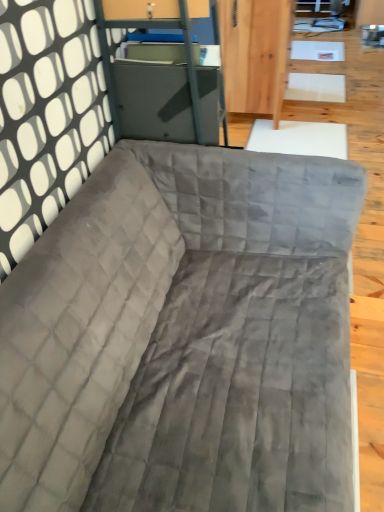
The height and width of the screenshot is (512, 384). In order to click on velvet gray couch at center in this screenshot , I will do `click(180, 339)`.

The image size is (384, 512). What do you see at coordinates (180, 339) in the screenshot?
I see `velvet gray couch at center` at bounding box center [180, 339].

What do you see at coordinates (146, 27) in the screenshot? This screenshot has width=384, height=512. I see `matte gray metal file cabinet at upper center` at bounding box center [146, 27].

Image resolution: width=384 pixels, height=512 pixels. I want to click on matte gray metal file cabinet at upper center, so click(146, 27).

This screenshot has width=384, height=512. Identify the location of velvet gray couch at center. (180, 339).

Between velvet gray couch at center and matte gray metal file cabinet at upper center, which one appears on the left side from the viewer's perspective?

matte gray metal file cabinet at upper center.

Is velvet gray couch at center behind matte gray metal file cabinet at upper center?

That is False.

Is point (37, 408) in front of point (179, 14)?

Yes.

Looking at this image, from the image's perspective, does velvet gray couch at center appear lower than matte gray metal file cabinet at upper center?

Indeed, from the image's perspective, velvet gray couch at center is shown beneath matte gray metal file cabinet at upper center.

From a real-world perspective, is velvet gray couch at center beneath matte gray metal file cabinet at upper center?

Indeed, from a real-world perspective, velvet gray couch at center is positioned beneath matte gray metal file cabinet at upper center.

Which object is wider, velvet gray couch at center or matte gray metal file cabinet at upper center?

With larger width is velvet gray couch at center.

Is velvet gray couch at center taller than matte gray metal file cabinet at upper center?

Correct, velvet gray couch at center is much taller as matte gray metal file cabinet at upper center.

Does velvet gray couch at center have a larger size compared to matte gray metal file cabinet at upper center?

Correct, velvet gray couch at center is larger in size than matte gray metal file cabinet at upper center.

Is velvet gray couch at center inside the boundaries of matte gray metal file cabinet at upper center, or outside?

velvet gray couch at center is outside matte gray metal file cabinet at upper center.

Is the surface of velvet gray couch at center in direct contact with matte gray metal file cabinet at upper center?

No, velvet gray couch at center is not next to matte gray metal file cabinet at upper center.

Is velvet gray couch at center facing towards matte gray metal file cabinet at upper center?

No, velvet gray couch at center is not turned towards matte gray metal file cabinet at upper center.

How far apart are velvet gray couch at center and matte gray metal file cabinet at upper center?

velvet gray couch at center and matte gray metal file cabinet at upper center are 19.77 inches apart from each other.

This screenshot has height=512, width=384. In order to click on studio couch on the right of matte gray metal file cabinet at upper center in this screenshot , I will do `click(180, 339)`.

Is matte gray metal file cabinet at upper center to the left or to the right of velvet gray couch at center in the image?

Based on their positions, matte gray metal file cabinet at upper center is located to the left of velvet gray couch at center.

Between matte gray metal file cabinet at upper center and velvet gray couch at center, which one is positioned behind?

Positioned behind is matte gray metal file cabinet at upper center.

Considering the positions of point (189, 61) and point (268, 316), is point (189, 61) closer or farther from the camera than point (268, 316)?

Clearly, point (189, 61) is closer to the camera than point (268, 316).

From the image's perspective, is matte gray metal file cabinet at upper center on velvet gray couch at center?

Correct, matte gray metal file cabinet at upper center appears higher than velvet gray couch at center in the image.

From a real-world perspective, is matte gray metal file cabinet at upper center on top of velvet gray couch at center?

Yes.

Is matte gray metal file cabinet at upper center wider than velvet gray couch at center?

Incorrect, the width of matte gray metal file cabinet at upper center does not surpass that of velvet gray couch at center.

Can you confirm if matte gray metal file cabinet at upper center is shorter than velvet gray couch at center?

Yes.

Looking at the image, does matte gray metal file cabinet at upper center seem bigger or smaller compared to velvet gray couch at center?

Clearly, matte gray metal file cabinet at upper center is smaller in size than velvet gray couch at center.

Is matte gray metal file cabinet at upper center not within velvet gray couch at center?

That's correct, matte gray metal file cabinet at upper center is outside of velvet gray couch at center.

Is matte gray metal file cabinet at upper center next to velvet gray couch at center?

No, matte gray metal file cabinet at upper center is not in contact with velvet gray couch at center.

Is matte gray metal file cabinet at upper center oriented away from velvet gray couch at center?

matte gray metal file cabinet at upper center is not turned away from velvet gray couch at center.

At what (x,y) coordinates should I click in order to perform the action: click on studio couch to the right of matte gray metal file cabinet at upper center. Please return your answer as a coordinate pair (x, y). This screenshot has width=384, height=512. Looking at the image, I should click on (180, 339).

The width and height of the screenshot is (384, 512). What are the coordinates of `studio couch in front of the matte gray metal file cabinet at upper center` in the screenshot? It's located at (180, 339).

This screenshot has width=384, height=512. I want to click on studio couch on the right of the matte gray metal file cabinet at upper center, so click(180, 339).